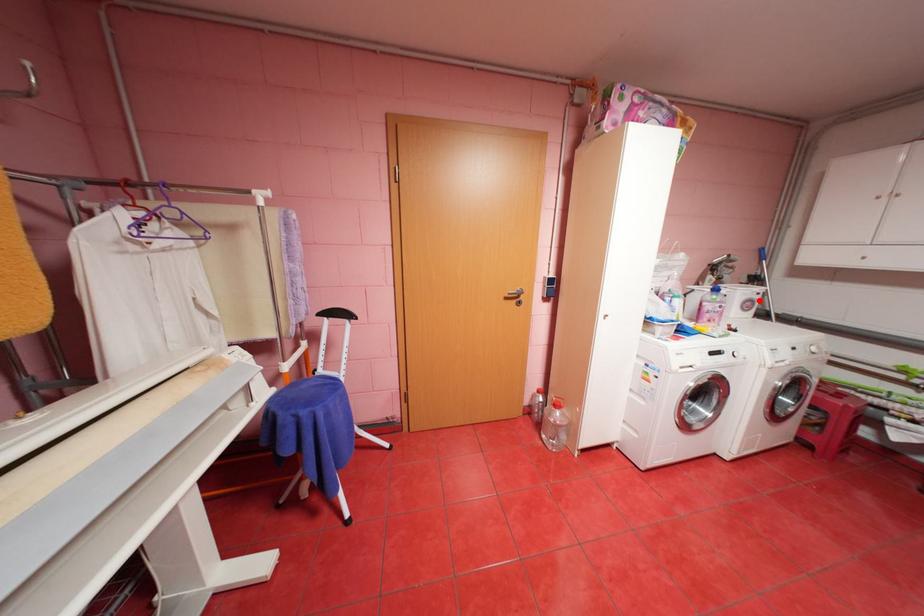
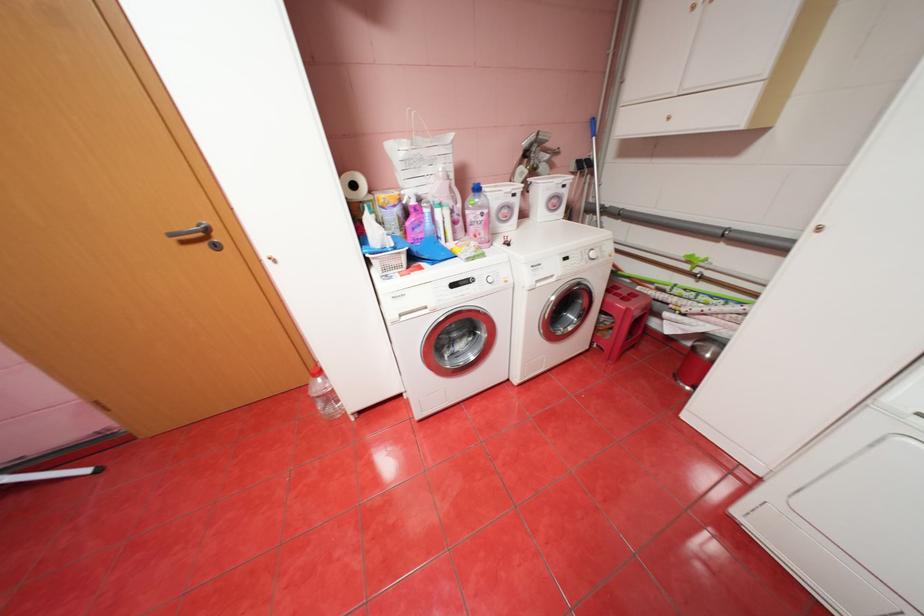
Find the pixel in the second image that matches the highlighted location in the first image.

(566, 197)